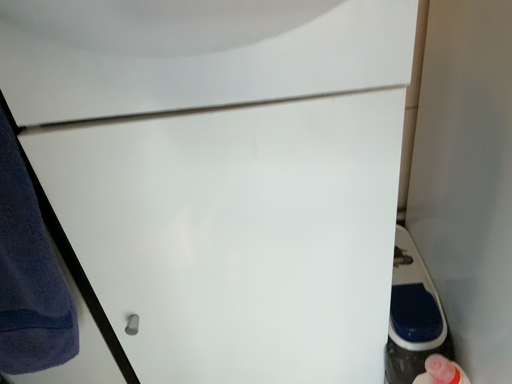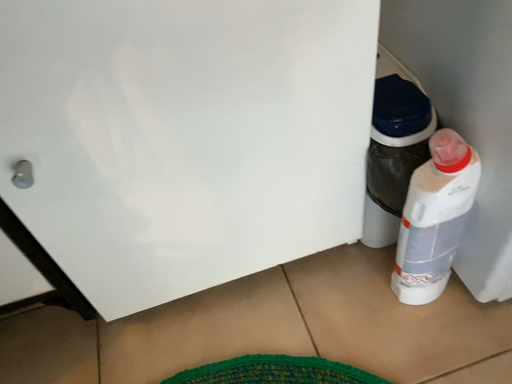
Question: Which way did the camera rotate in the video?

Choices:
 (A) rotated right
 (B) rotated left

Answer: (A)